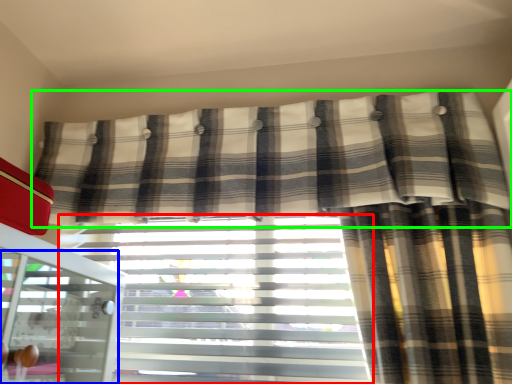
Question: Which object is positioned closest to window blind (highlighted by a red box)? Select from screen door (highlighted by a blue box) and curtain (highlighted by a green box).

Choices:
 (A) screen door
 (B) curtain

Answer: (B)